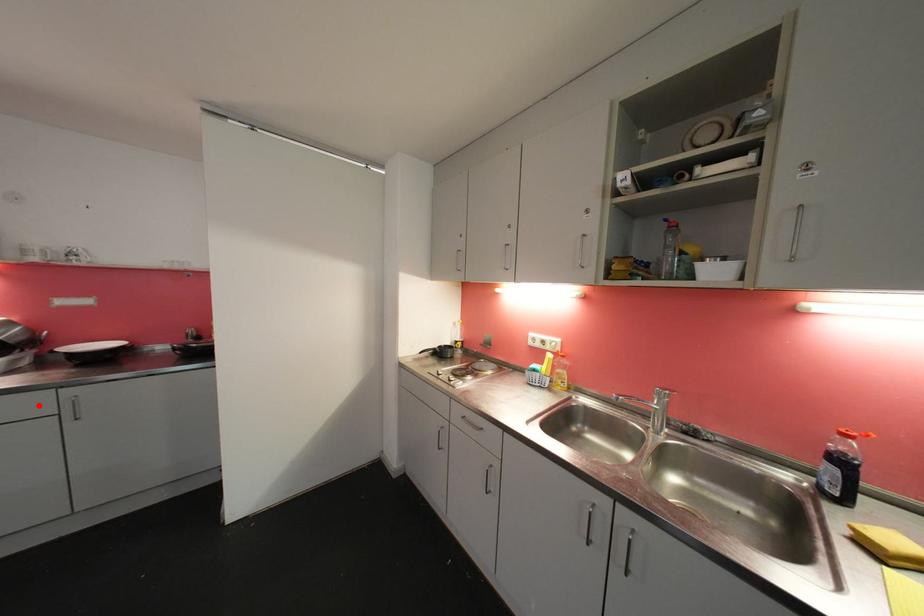
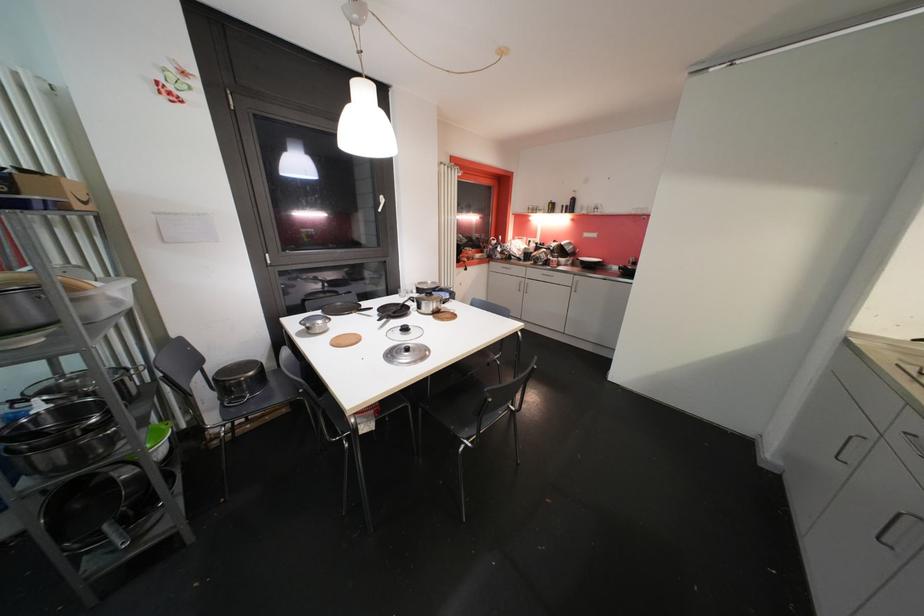
The point at the highlighted location is marked in the first image. Where is the corresponding point in the second image?

(572, 282)